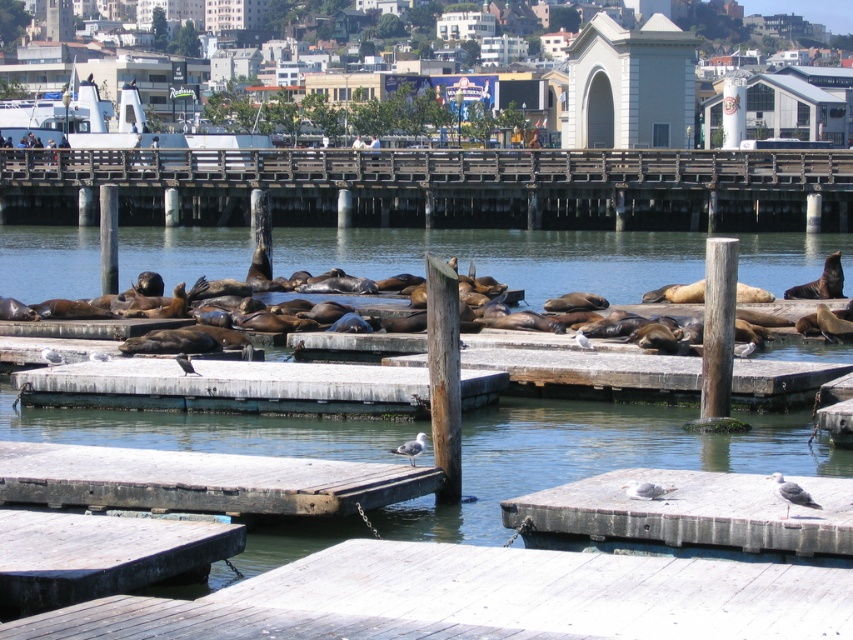
Question: Is concrete gray dock at lower right below wooden dock at center?

Choices:
 (A) no
 (B) yes

Answer: (B)

Question: Is wooden at center wider than smooth concrete dock at center?

Choices:
 (A) yes
 (B) no

Answer: (A)

Question: Which point is farther from the camera taking this photo?

Choices:
 (A) (338, 492)
 (B) (312, 410)
 (C) (630, 182)

Answer: (C)

Question: Among these points, which one is nearest to the camera?

Choices:
 (A) (488, 528)
 (B) (26, 456)
 (C) (254, 387)

Answer: (B)

Question: Which point appears farthest from the camera in this image?

Choices:
 (A) (285, 497)
 (B) (521, 412)
 (C) (248, 369)

Answer: (B)

Question: Is brown wooden water at center bigger than white wood dock at lower center?

Choices:
 (A) no
 (B) yes

Answer: (B)